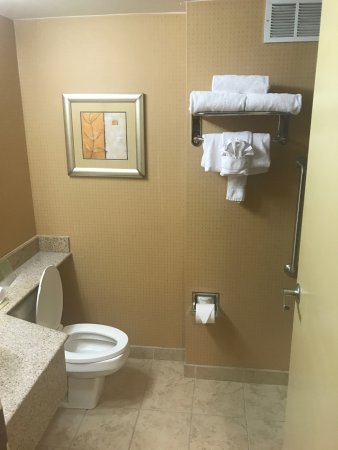
At what (x,y) coordinates should I click in order to perform the action: click on counter top. Please return your answer as a coordinate pair (x, y). The width and height of the screenshot is (338, 450). Looking at the image, I should click on (27, 266), (37, 344).